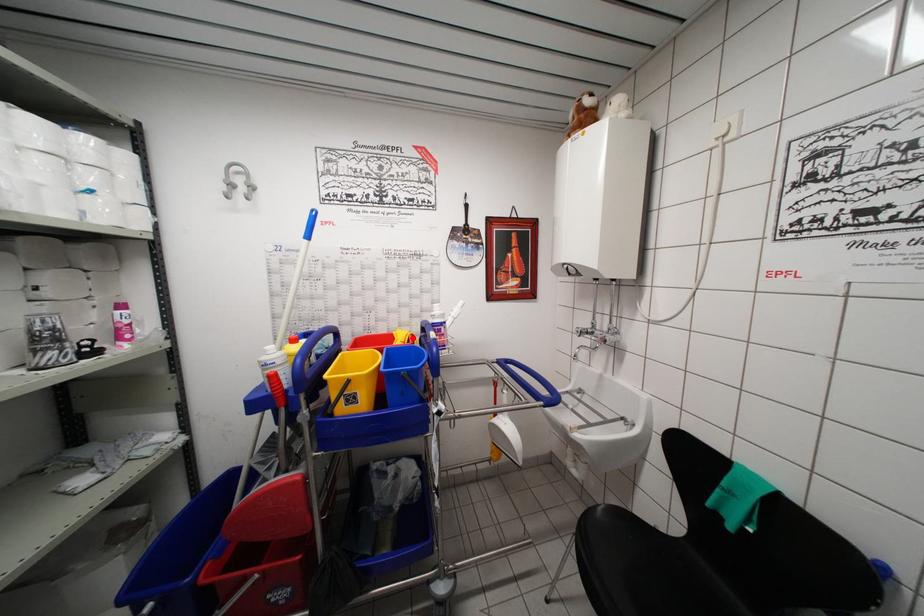
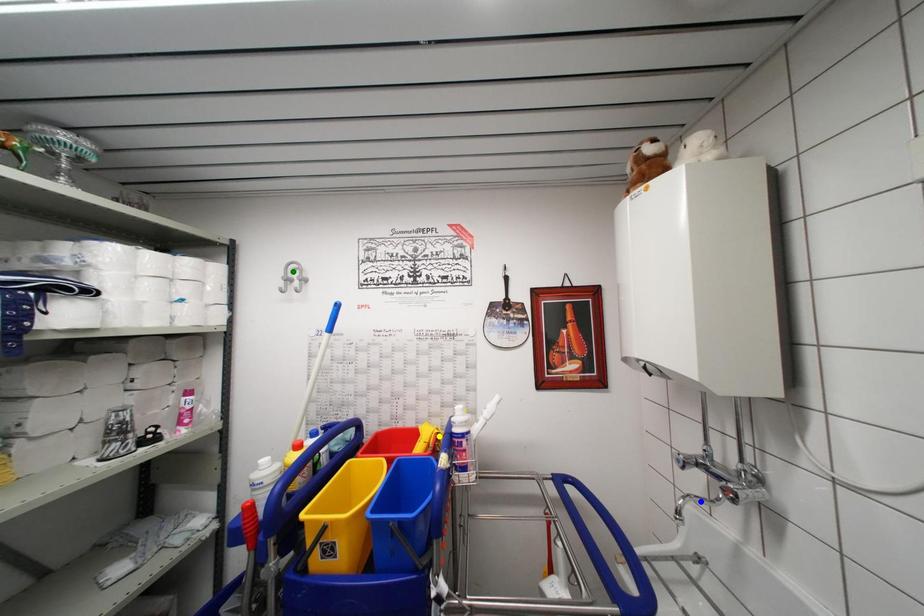
Question: I am providing you with two images of the same scene from different viewpoints. A red point is marked on the first image. You are given multiple points on the second image. Which point in image 2 represents the same 3d spot as the red point in image 1?

Choices:
 (A) green point
 (B) yellow point
 (C) blue point

Answer: (B)